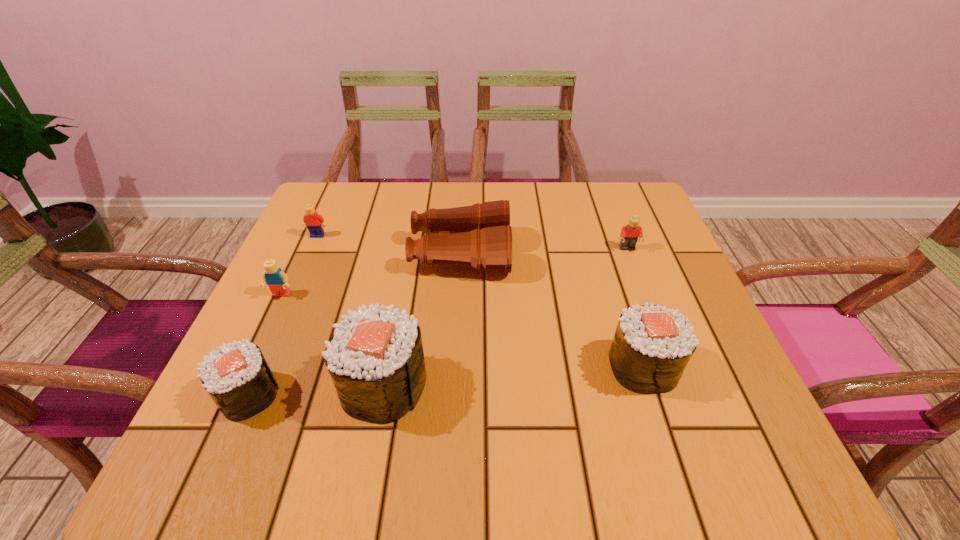
Where is `the leftmost sushi`? The height and width of the screenshot is (540, 960). the leftmost sushi is located at coordinates (237, 377).

Locate an element on the screen. This screenshot has width=960, height=540. the tallest sushi is located at coordinates (375, 358).

You are a GUI agent. You are given a task and a screenshot of the screen. Output one action in this format:
    pyautogui.click(x=<x>, y=<y>)
    Task: Click on the second sushi from left to right
    
    Given the screenshot: What is the action you would take?
    pyautogui.click(x=375, y=358)

This screenshot has width=960, height=540. I want to click on the second tallest sushi, so pyautogui.click(x=652, y=345).

You are a GUI agent. You are given a task and a screenshot of the screen. Output one action in this format:
    pyautogui.click(x=<x>, y=<y>)
    Task: Click on the binoculars
    The image size is (960, 540).
    Given the screenshot: What is the action you would take?
    pyautogui.click(x=479, y=236)

At what (x,y) coordinates should I click in order to perform the action: click on the fourth farthest object. Please return your answer as a coordinate pair (x, y). This screenshot has height=540, width=960. Looking at the image, I should click on point(274,277).

At what (x,y) coordinates should I click in order to perform the action: click on the second farthest Lego. Please return your answer as a coordinate pair (x, y). Image resolution: width=960 pixels, height=540 pixels. Looking at the image, I should click on (629, 235).

The image size is (960, 540). I want to click on the farthest Lego, so click(315, 223).

Locate an element on the screen. The image size is (960, 540). vacant point located 0.120m on the right of the leftmost sushi is located at coordinates tap(347, 395).

Identify the location of free space located 0.160m on the back of the second sushi from right to left. (401, 292).